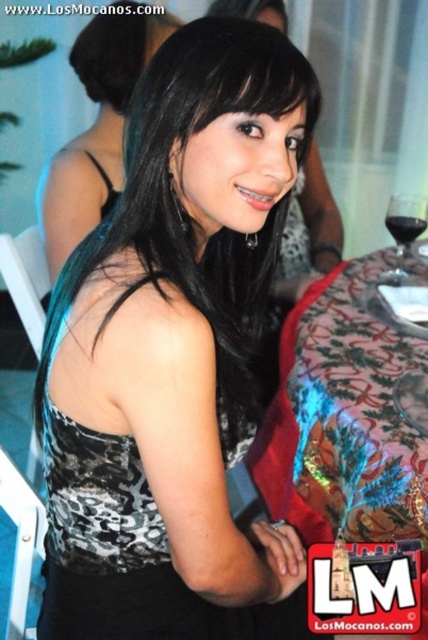
Question: Which of the following is the closest to the observer?

Choices:
 (A) pos(401,262)
 (B) pos(109,33)
 (C) pos(344,371)

Answer: (C)

Question: Which point is closer to the camera?

Choices:
 (A) printed fabric tablecloth at lower right
 (B) transparent glass at upper right

Answer: (A)

Question: Which point is closer to the camera?

Choices:
 (A) black leopard print dress at center
 (B) printed fabric tablecloth at lower right
 (C) black satin dress at center
 (D) transparent glass at upper right

Answer: (A)

Question: Can you confirm if black leopard print dress at center is bigger than transparent glass at upper right?

Choices:
 (A) yes
 (B) no

Answer: (A)

Question: From the image, what is the correct spatial relationship of black leopard print dress at center in relation to black satin dress at center?

Choices:
 (A) above
 (B) below

Answer: (B)

Question: Is black satin dress at center bigger than transparent glass at upper right?

Choices:
 (A) no
 (B) yes

Answer: (B)